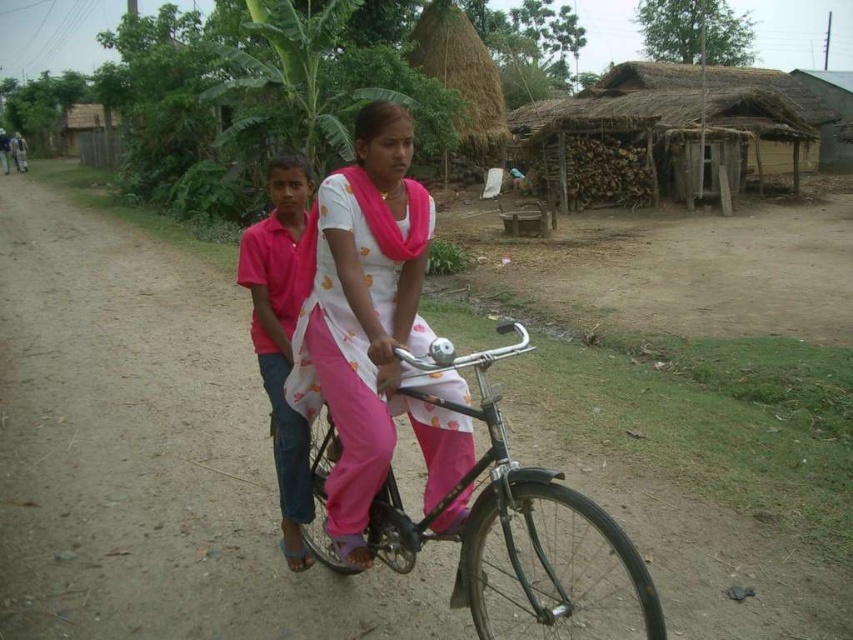
Which is in front, point (611, 176) or point (476, 406)?

Point (476, 406) is in front.

From the picture: Can you confirm if thatched roof hut at upper right is smaller than metallic silver bicycle at center?

Incorrect, thatched roof hut at upper right is not smaller in size than metallic silver bicycle at center.

Is point (666, 108) farther from viewer compared to point (628, 540)?

Yes.

Where is `thatched roof hut at upper right`? This screenshot has height=640, width=853. thatched roof hut at upper right is located at coordinates (672, 132).

Is thatched roof hut at upper right to the left of pink cotton shirt at center from the viewer's perspective?

No, thatched roof hut at upper right is not to the left of pink cotton shirt at center.

Measure the distance between point (650,145) and camera.

A distance of 20.14 meters exists between point (650,145) and camera.

Where is `thatched roof hut at upper right`? thatched roof hut at upper right is located at coordinates (672, 132).

Between brown dirt track at center and metallic silver bicycle at center, which one is positioned lower?

Positioned lower is metallic silver bicycle at center.

Is brown dirt track at center above metallic silver bicycle at center?

Indeed, brown dirt track at center is positioned over metallic silver bicycle at center.

Locate an element on the screen. The width and height of the screenshot is (853, 640). brown dirt track at center is located at coordinates (151, 451).

The height and width of the screenshot is (640, 853). In order to click on brown dirt track at center in this screenshot , I will do `click(151, 451)`.